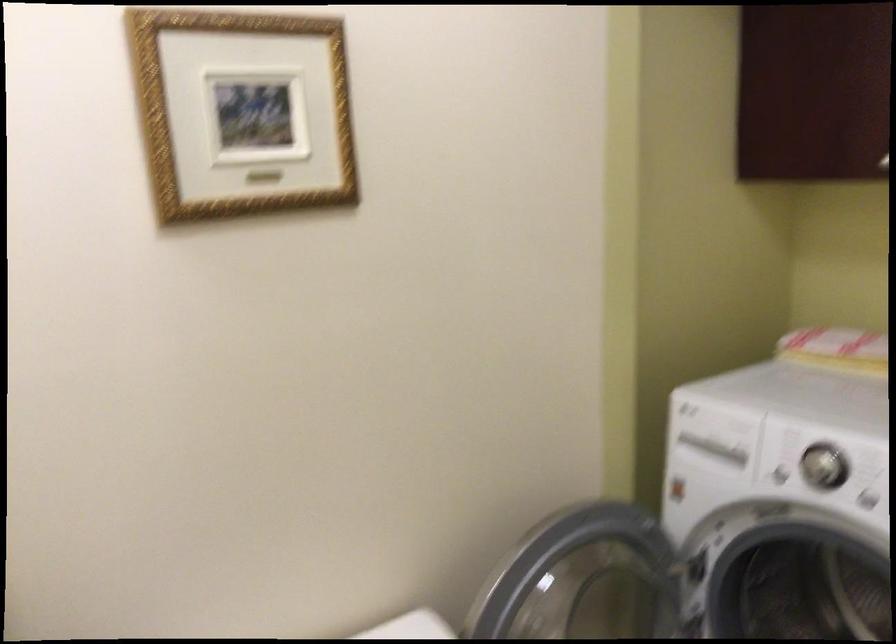
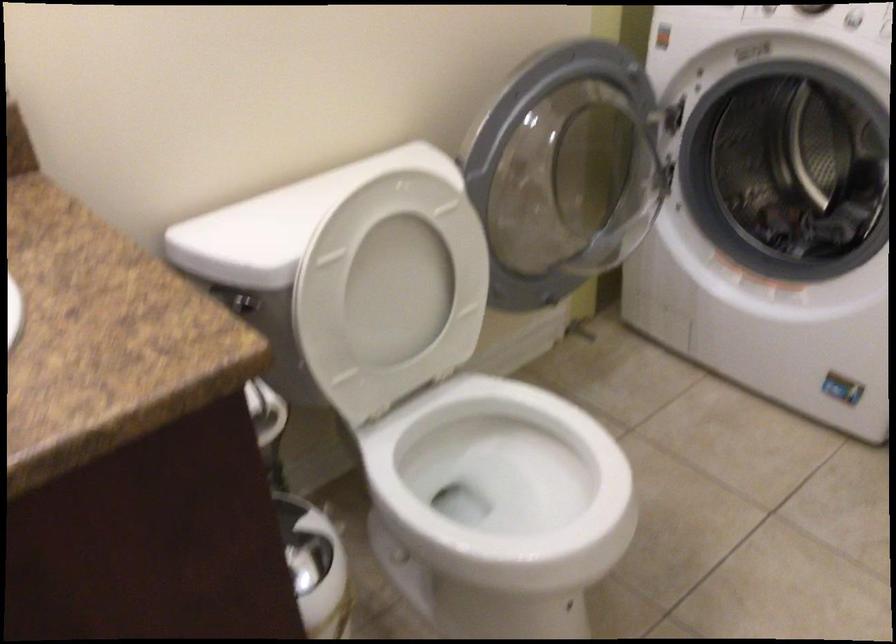
Question: How did the camera likely rotate?

Choices:
 (A) Left
 (B) Right
 (C) Up
 (D) Down

Answer: (D)